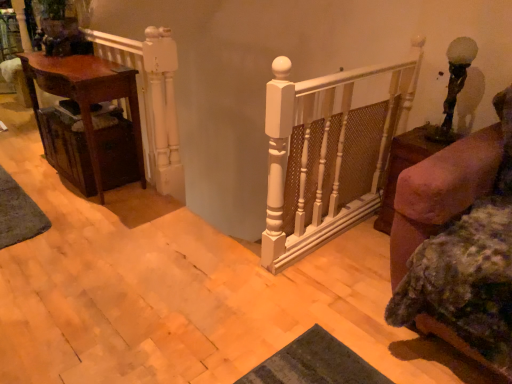
At what (x,y) coordinates should I click in order to perform the action: click on unoccupied area in front of woven brown drawer at left. Please return your answer as a coordinate pair (x, y). Looking at the image, I should click on (84, 209).